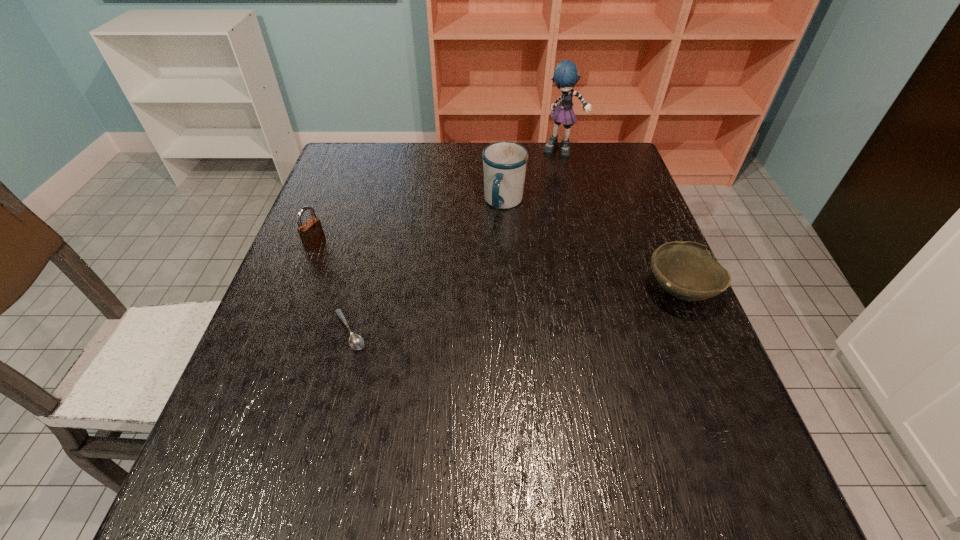
Identify the location of free space located on the back of the shortest object. (380, 210).

Identify the location of vacant space located 0.130m on the front of the bowl. (715, 372).

You are a GUI agent. You are given a task and a screenshot of the screen. Output one action in this format:
    pyautogui.click(x=<x>, y=<y>)
    Task: Click on the vacant area situated on the handle side of the fourth nearest object
    
    Given the screenshot: What is the action you would take?
    pyautogui.click(x=484, y=290)

I want to click on free spot located 0.390m on the handle side of the fourth nearest object, so click(471, 340).

Locate an element on the screen. free region located 0.370m on the handle side of the fourth nearest object is located at coordinates click(x=473, y=332).

Where is `vacant region located 0.090m on the front-facing side of the third farthest object`? The width and height of the screenshot is (960, 540). vacant region located 0.090m on the front-facing side of the third farthest object is located at coordinates (350, 259).

You are a GUI agent. You are given a task and a screenshot of the screen. Output one action in this format:
    pyautogui.click(x=<x>, y=<y>)
    Task: Click on the vacant space located on the front-facing side of the third farthest object
    The width and height of the screenshot is (960, 540).
    Given the screenshot: What is the action you would take?
    pyautogui.click(x=378, y=269)

This screenshot has height=540, width=960. Identify the location of vacant region located 0.230m on the front-facing side of the third farthest object. (399, 278).

In order to click on vacant space located 0.060m on the front-facing side of the tallest object in this screenshot , I will do `click(560, 167)`.

I want to click on free space located 0.250m on the front-facing side of the tallest object, so click(x=557, y=205).